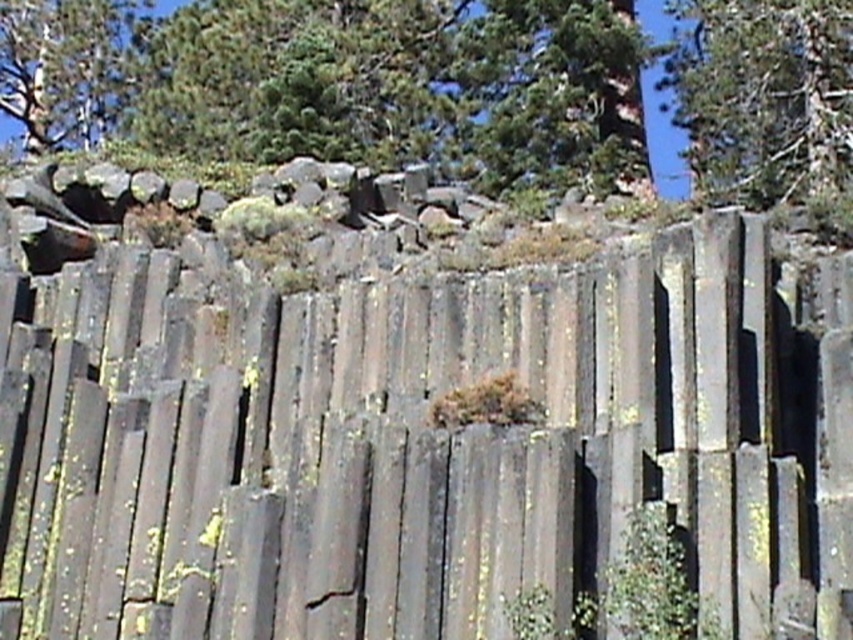
You are standing at the base of the basalt columns and want to take a photo of the green leafy tree at upper right. If your camera has a maximum focus range of 25 meters, will you be able to capture the tree clearly?

The green leafy tree at upper right is 25.99 meters away from the camera. Since the camera can only focus up to 25 meters, it will not be able to capture the tree clearly.

You are a geologist examining the image and want to determine the relationship between the gray stone columns at center and the green leafy tree at upper center. Which object is located higher in the image?

The green leafy tree at upper center is higher in the image because it is positioned above the gray stone columns at center.

In the scene shown: You are a hiker standing at the base of the basalt columns looking upward. You notice two green leafy trees in the upper part of the scene. Which tree is closer to you between the green leafy tree at upper right and the green leafy tree at upper center?

The green leafy tree at upper right is positioned under the green leafy tree at upper center, so the tree at upper right is closer to you.